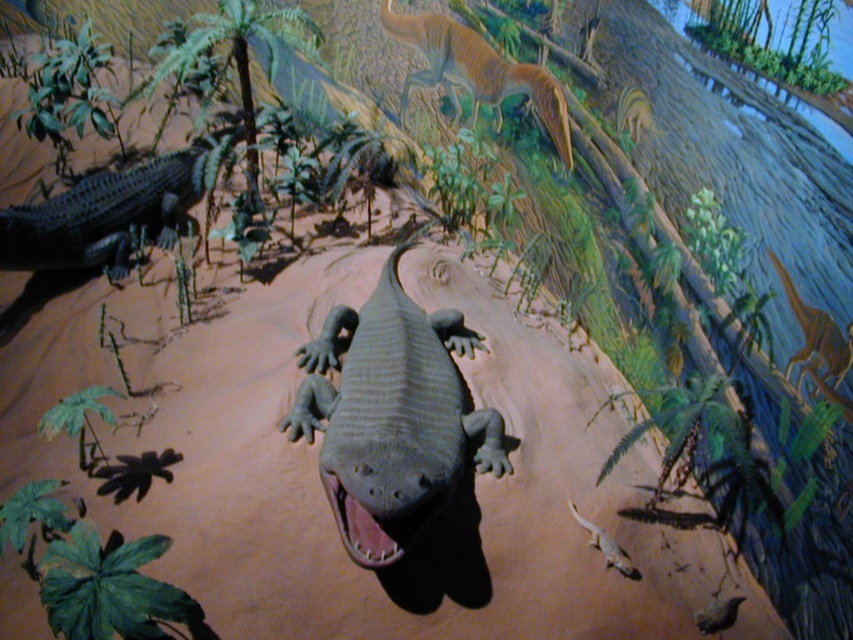
Question: Is smooth brown dinosaur at upper center behind smooth brown dinosaur at upper right?

Choices:
 (A) yes
 (B) no

Answer: (A)

Question: Based on their relative distances, which object is nearer to the smooth beige lizard at lower center?

Choices:
 (A) shiny brown bird at center
 (B) smooth brown dinosaur at upper right

Answer: (A)

Question: Based on their relative distances, which object is nearer to the smooth brown dinosaur at upper right?

Choices:
 (A) smooth brown dinosaur at upper center
 (B) shiny brown bird at center

Answer: (B)

Question: From the image, what is the correct spatial relationship of smooth brown dinosaur at upper center in relation to shiny brown bird at center?

Choices:
 (A) below
 (B) above

Answer: (B)

Question: Which of the following is the farthest from the observer?

Choices:
 (A) (612, 544)
 (B) (418, 403)
 (C) (415, 80)

Answer: (C)

Question: Does smooth brown dinosaur at upper center have a lesser width compared to shiny brown bird at center?

Choices:
 (A) no
 (B) yes

Answer: (A)